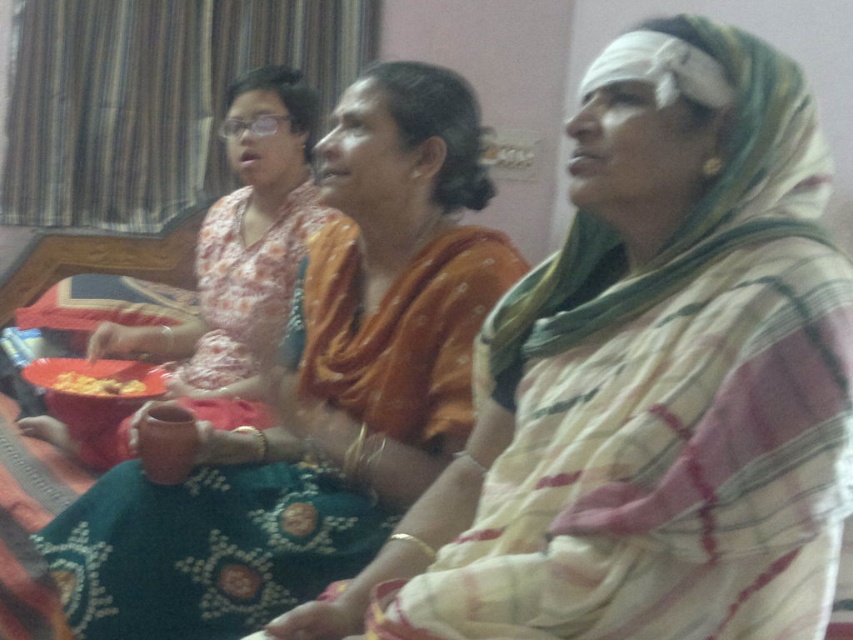
Based on the scene described, which object is positioned to the left of the other between the matte orange sari at center and the matte orange bowl at center?

The matte orange bowl at center is to the left of the matte orange sari at center because the sari is located to the right of the bowl.

Based on the scene description, which bowl is positioned lower between the matte brown bowl at center and the matte orange bowl at center?

The matte brown bowl at center is located below the matte orange bowl at center, so it is positioned lower.

You are a photographer trying to capture the matte orange sari at center and the yellow crispy snack at lower left in a single frame. Based on their positions, which object should you focus on first to ensure both are in the frame?

The matte orange sari at center is located above the yellow crispy snack at lower left, so you should focus on the yellow crispy snack at lower left first to ensure both are within the frame.